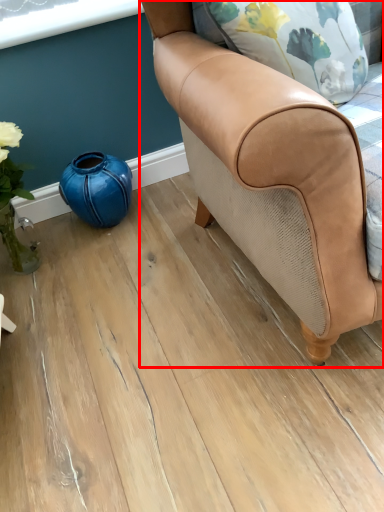
Question: Considering the relative positions of chair (annotated by the red box) and teal in the image provided, where is chair (annotated by the red box) located with respect to the staircase?

Choices:
 (A) right
 (B) left

Answer: (A)